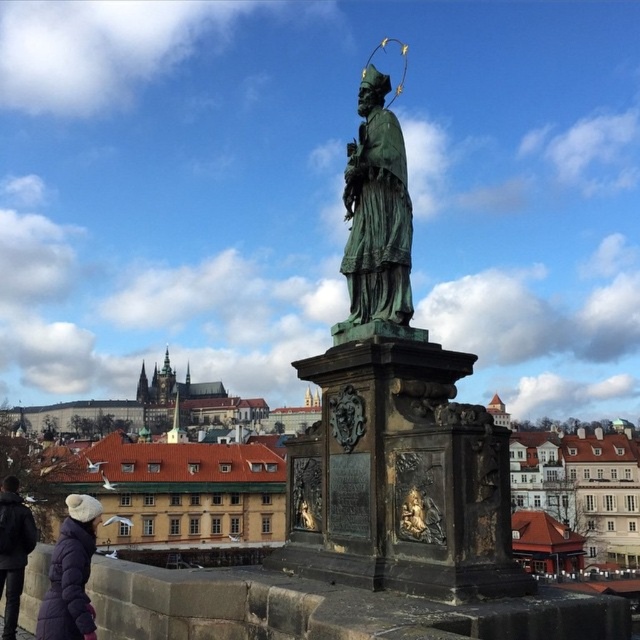
What are the coordinates of `green patina statue at center` in the screenshot? It's located at (394, 417).

Is green patina statue at center to the right of green polished statue at center from the viewer's perspective?

In fact, green patina statue at center is to the left of green polished statue at center.

Identify the location of green patina statue at center. (394, 417).

Does green patina statue at center have a greater height compared to purple puffy coat at lower left?

Indeed, green patina statue at center has a greater height compared to purple puffy coat at lower left.

Who is positioned more to the left, green patina statue at center or purple puffy coat at lower left?

Positioned to the left is purple puffy coat at lower left.

Which is in front, point (362, 241) or point (54, 616)?

Positioned in front is point (54, 616).

Where is `green patina statue at center`? This screenshot has height=640, width=640. green patina statue at center is located at coordinates (394, 417).

Between green polished statue at center and dark gray jacket at lower left, which one is positioned lower?

dark gray jacket at lower left

How distant is green polished statue at center from dark gray jacket at lower left?

green polished statue at center is 48.71 meters away from dark gray jacket at lower left.

Which is behind, point (387, 154) or point (22, 506)?

Positioned behind is point (22, 506).

You are a GUI agent. You are given a task and a screenshot of the screen. Output one action in this format:
    pyautogui.click(x=<x>, y=<y>)
    Task: Click on the green polished statue at center
    Image resolution: width=640 pixels, height=640 pixels.
    Given the screenshot: What is the action you would take?
    click(x=378, y=211)